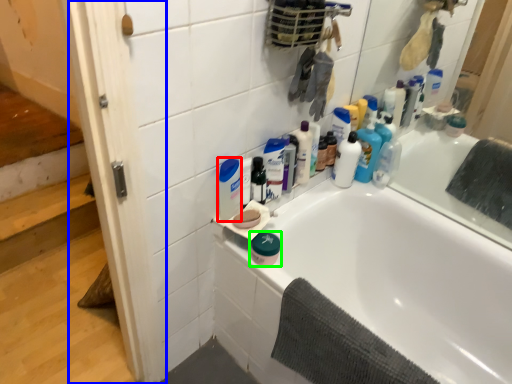
Question: Considering the real-world distances, which object is farthest from cleaning product (highlighted by a red box)? screen door (highlighted by a blue box) or product (highlighted by a green box)?

Choices:
 (A) screen door
 (B) product

Answer: (A)